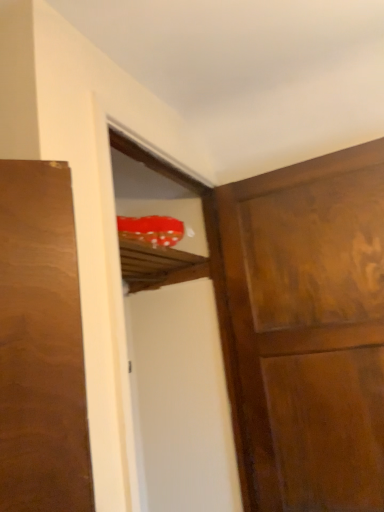
Question: In terms of height, does transparent plastic screen door at upper center look taller or shorter compared to wooden door at upper right?

Choices:
 (A) short
 (B) tall

Answer: (B)

Question: From a real-world perspective, relative to wooden door at upper right, is transparent plastic screen door at upper center vertically above or below?

Choices:
 (A) below
 (B) above

Answer: (B)

Question: Considering the positions of transparent plastic screen door at upper center and wooden door at upper right in the image, is transparent plastic screen door at upper center bigger or smaller than wooden door at upper right?

Choices:
 (A) big
 (B) small

Answer: (A)

Question: Would you say wooden door at upper right is to the left or to the right of transparent plastic screen door at upper center in the picture?

Choices:
 (A) left
 (B) right

Answer: (B)

Question: From the image's perspective, is wooden door at upper right above or below transparent plastic screen door at upper center?

Choices:
 (A) below
 (B) above

Answer: (A)

Question: Is wooden door at upper right inside or outside of transparent plastic screen door at upper center?

Choices:
 (A) inside
 (B) outside

Answer: (B)

Question: Is point (367, 281) closer or farther from the camera than point (157, 168)?

Choices:
 (A) closer
 (B) farther

Answer: (A)